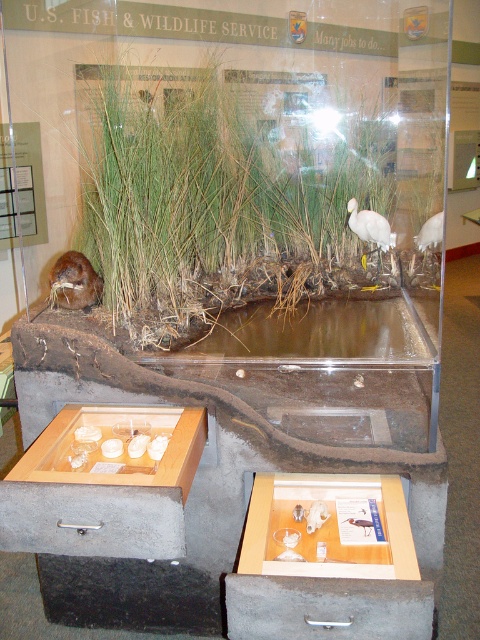
You are standing in front of the educational display and want to take a photo of the point at coordinates point (432, 240). Your camera has a maximum focus range of 3 meters. Will the camera be able to focus on the point?

The point (432, 240) is 2.65 meters from the camera, so yes, the camera can focus on the point since it is within the 3 meter range.